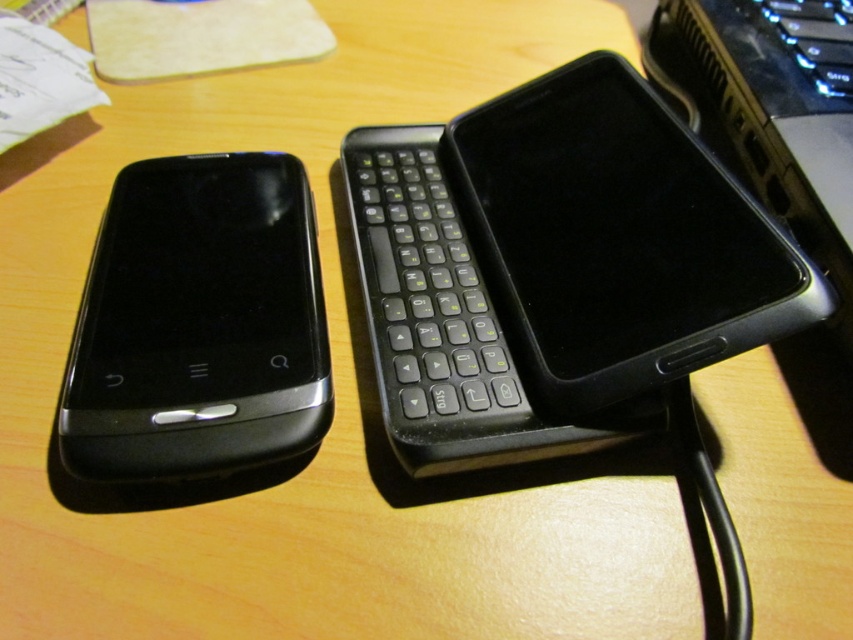
Does black matte smartphone at center have a greater height compared to black glossy smartphone at left?

Yes, black matte smartphone at center is taller than black glossy smartphone at left.

Is point (657, 282) positioned after point (122, 192)?

No, (657, 282) is closer to viewer.

Find the location of a particular element. black matte smartphone at center is located at coordinates (618, 237).

At what (x,y) coordinates should I click in order to perform the action: click on black matte smartphone at center. Please return your answer as a coordinate pair (x, y). The width and height of the screenshot is (853, 640). Looking at the image, I should click on (618, 237).

Is black matte smartphone at center thinner than black plastic keyboard at center?

Correct, black matte smartphone at center's width is less than black plastic keyboard at center's.

Can you confirm if black matte smartphone at center is positioned to the left of black plastic keyboard at center?

In fact, black matte smartphone at center is to the right of black plastic keyboard at center.

Between point (630, 257) and point (384, 376), which one is positioned in front?

Point (384, 376) is more forward.

Locate an element on the screen. black matte smartphone at center is located at coordinates click(x=618, y=237).

Is black glossy smartphone at left bigger than black plastic keyboard at center?

No, black glossy smartphone at left is not bigger than black plastic keyboard at center.

This screenshot has height=640, width=853. Describe the element at coordinates (198, 323) in the screenshot. I see `black glossy smartphone at left` at that location.

Is point (270, 244) positioned in front of point (408, 188)?

Yes.

Find the location of `black glossy smartphone at left`. black glossy smartphone at left is located at coordinates (198, 323).